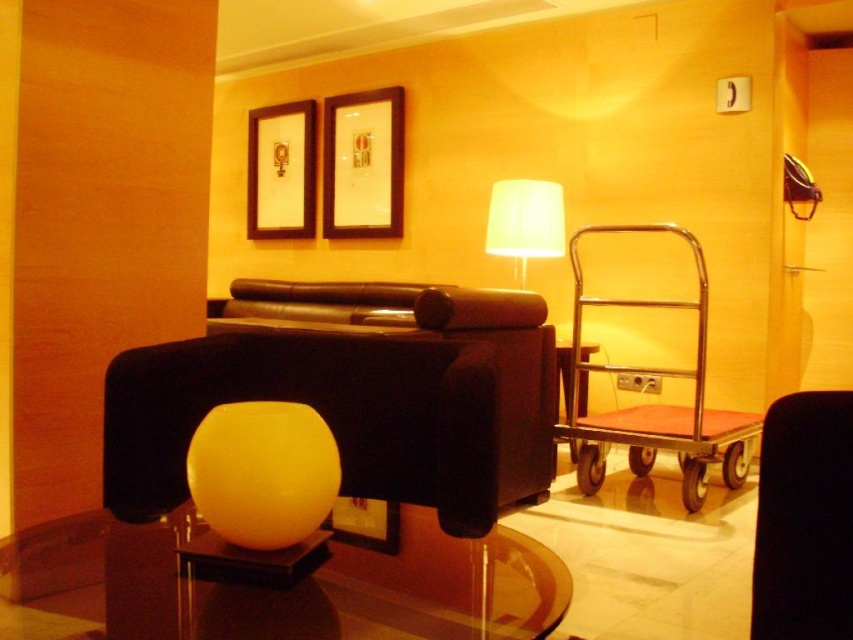
You are a guest in this hotel room and want to hang a new painting. The wooden picture frame at upper center and the white fabric lampshade at upper center are currently on the wall. Which object takes up more space on the wall?

The wooden picture frame at upper center is bigger than the white fabric lampshade at upper center, so it takes up more space on the wall.

You are standing in the room and want to place a small plant on the transparent glass table at center. Can you see the wooden picture frame at upper center from the plant once it is placed?

Yes, because the transparent glass table at center is closer to the viewer than wooden picture frame at upper center, the plant placed on the table would still allow viewing the frame behind it through the transparent surface.